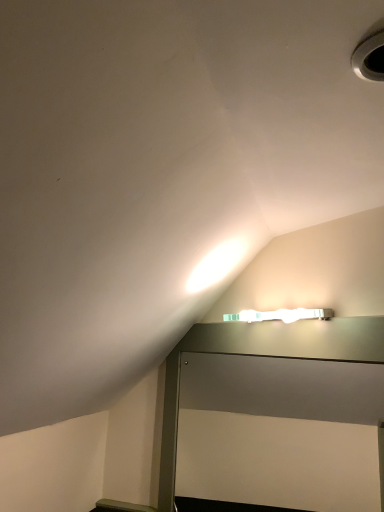
Question: In terms of size, does white plastic hole at upper right appear bigger or smaller than metallic gray table at upper center?

Choices:
 (A) small
 (B) big

Answer: (A)

Question: Is white plastic hole at upper right spatially inside metallic gray table at upper center, or outside of it?

Choices:
 (A) inside
 (B) outside

Answer: (B)

Question: From a real-world perspective, is white plastic hole at upper right positioned above or below metallic gray table at upper center?

Choices:
 (A) below
 (B) above

Answer: (B)

Question: Considering the positions of metallic gray table at upper center and white plastic hole at upper right in the image, is metallic gray table at upper center taller or shorter than white plastic hole at upper right?

Choices:
 (A) short
 (B) tall

Answer: (B)

Question: Considering the relative positions of metallic gray table at upper center and white plastic hole at upper right in the image provided, is metallic gray table at upper center to the left or to the right of white plastic hole at upper right?

Choices:
 (A) right
 (B) left

Answer: (B)

Question: In terms of width, does metallic gray table at upper center look wider or thinner when compared to white plastic hole at upper right?

Choices:
 (A) wide
 (B) thin

Answer: (B)

Question: Is point (248, 348) positioned closer to the camera than point (382, 57)?

Choices:
 (A) closer
 (B) farther

Answer: (B)